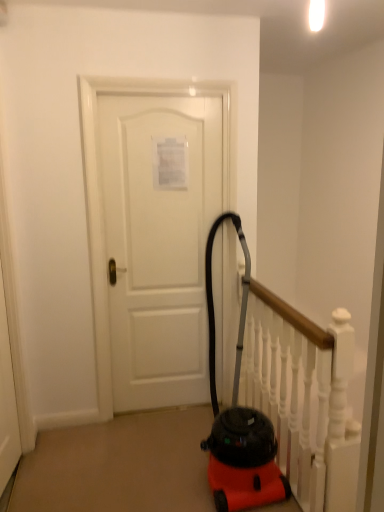
The width and height of the screenshot is (384, 512). I want to click on white matte door at center, so click(159, 243).

This screenshot has width=384, height=512. What do you see at coordinates (159, 243) in the screenshot?
I see `white matte door at center` at bounding box center [159, 243].

Describe the element at coordinates (282, 404) in the screenshot. I see `white wooden rail at center` at that location.

Measure the distance between white wooden rail at center and camera.

white wooden rail at center is 1.73 meters from camera.

Find the location of a particular element. white wooden rail at center is located at coordinates (282, 404).

The width and height of the screenshot is (384, 512). In order to click on white matte door at center in this screenshot , I will do `click(159, 243)`.

Based on the photo, is white wooden rail at center at the left side of white matte door at center?

No, white wooden rail at center is not to the left of white matte door at center.

Which object is closer to the camera, white wooden rail at center or white matte door at center?

Positioned in front is white wooden rail at center.

Which is nearer, (338, 416) or (212, 217)?

Point (338, 416).

From the image's perspective, is white wooden rail at center below white matte door at center?

Yes, from the image's perspective, white wooden rail at center is below white matte door at center.

From a real-world perspective, is white wooden rail at center on white matte door at center?

No.

Considering the relative sizes of white wooden rail at center and white matte door at center in the image provided, is white wooden rail at center wider than white matte door at center?

Yes, white wooden rail at center is wider than white matte door at center.

Is white wooden rail at center taller or shorter than white matte door at center?

white wooden rail at center is shorter than white matte door at center.

Does white wooden rail at center have a larger size compared to white matte door at center?

Yes, white wooden rail at center is bigger than white matte door at center.

Would you say white wooden rail at center contains white matte door at center?

No, white matte door at center is not inside white wooden rail at center.

Are white wooden rail at center and white matte door at center located far from each other?

Actually, white wooden rail at center and white matte door at center are a little close together.

Does white wooden rail at center turn towards white matte door at center?

No, white wooden rail at center is not facing towards white matte door at center.

How many degrees apart are the facing directions of white wooden rail at center and white matte door at center?

0.487 degrees separate the facing orientations of white wooden rail at center and white matte door at center.

Consider the image. How distant is white wooden rail at center from white matte door at center?

The distance of white wooden rail at center from white matte door at center is 22.03 inches.

Find the location of a particular element. door located above the white wooden rail at center (from the image's perspective) is located at coordinates (159, 243).

Which object is positioned more to the left, white matte door at center or white wooden rail at center?

white matte door at center.

Considering their positions, is white matte door at center located in front of or behind white wooden rail at center?

Visually, white matte door at center is located behind white wooden rail at center.

Between point (214, 277) and point (243, 467), which one is positioned in front?

Point (243, 467)

From the image's perspective, who appears lower, white matte door at center or white wooden rail at center?

white wooden rail at center.

From a real-world perspective, which is physically above, white matte door at center or white wooden rail at center?

From a 3D spatial view, white matte door at center is above.

Does white matte door at center have a greater width compared to white wooden rail at center?

No, white matte door at center is not wider than white wooden rail at center.

Considering the relative sizes of white matte door at center and white wooden rail at center in the image provided, is white matte door at center shorter than white wooden rail at center?

Incorrect, the height of white matte door at center does not fall short of that of white wooden rail at center.

Between white matte door at center and white wooden rail at center, which one has smaller size?

Smaller between the two is white matte door at center.

Consider the image. Is white matte door at center inside or outside of white wooden rail at center?

white matte door at center lies outside white wooden rail at center.

In the scene shown: Is white matte door at center positioned far away from white wooden rail at center?

Actually, white matte door at center and white wooden rail at center are a little close together.

Is white matte door at center facing away from white wooden rail at center?

No, white matte door at center's orientation is not away from white wooden rail at center.

At what (x,y) coordinates should I click in order to perform the action: click on rail below the white matte door at center (from the image's perspective). Please return your answer as a coordinate pair (x, y). The width and height of the screenshot is (384, 512). Looking at the image, I should click on (282, 404).

Where is `door located on the left of white wooden rail at center`? This screenshot has width=384, height=512. door located on the left of white wooden rail at center is located at coordinates (159, 243).

Where is `door above the white wooden rail at center (from the image's perspective)`? door above the white wooden rail at center (from the image's perspective) is located at coordinates (159, 243).